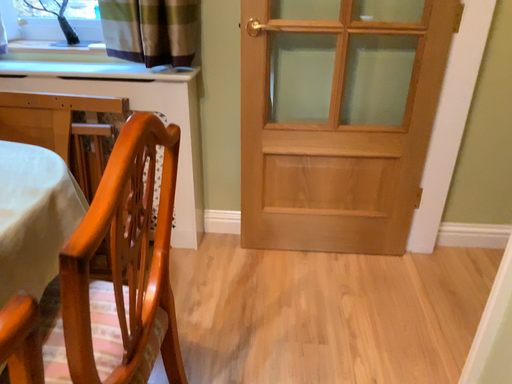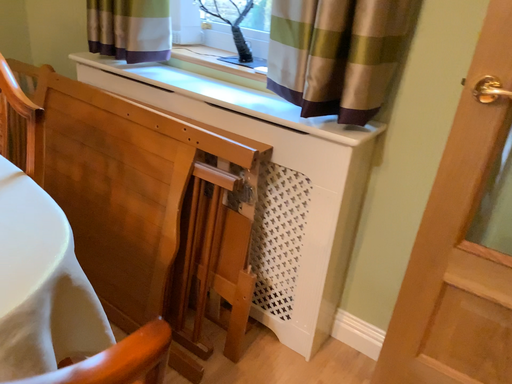
Question: How did the camera likely rotate when shooting the video?

Choices:
 (A) rotated left
 (B) rotated right

Answer: (A)